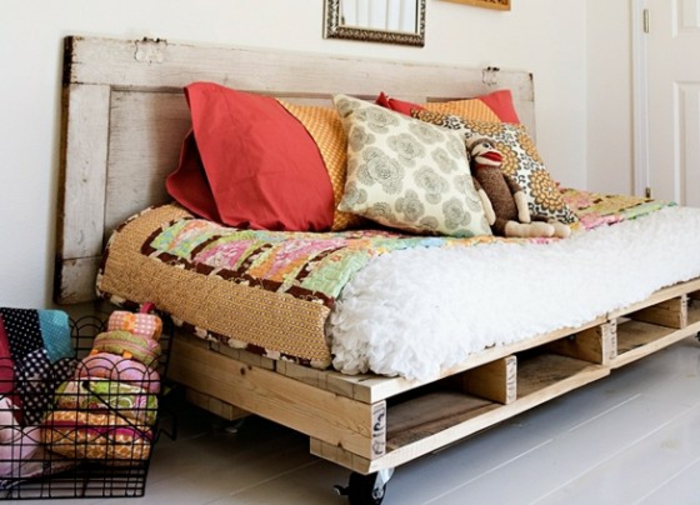
You are a GUI agent. You are given a task and a screenshot of the screen. Output one action in this format:
    pyautogui.click(x=<x>, y=<y>)
    Task: Click on the headboard top piece
    This screenshot has height=505, width=700.
    Given the screenshot: What is the action you would take?
    [250, 72]